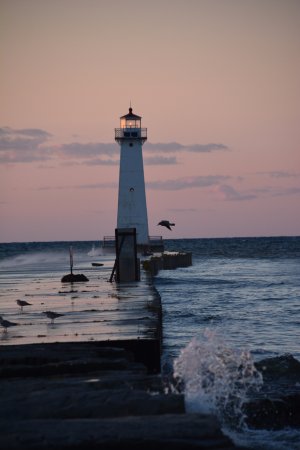
Locate an element on the screen. The height and width of the screenshot is (450, 300). lamp is located at coordinates (130, 122).